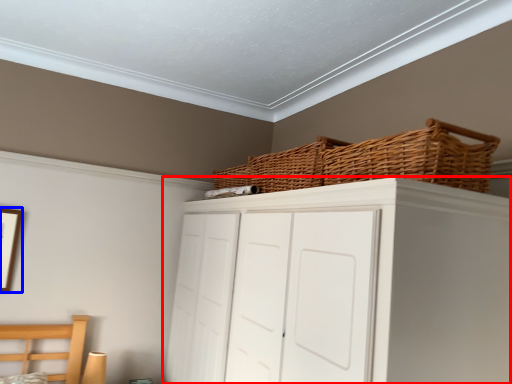
Question: Which object is further to the camera taking this photo, cupboard (highlighted by a red box) or picture frame (highlighted by a blue box)?

Choices:
 (A) cupboard
 (B) picture frame

Answer: (B)